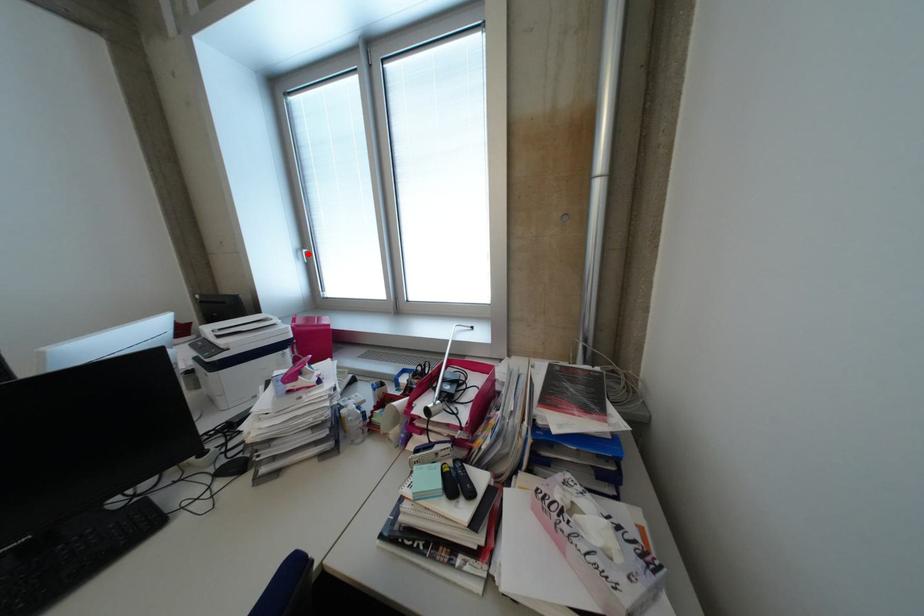
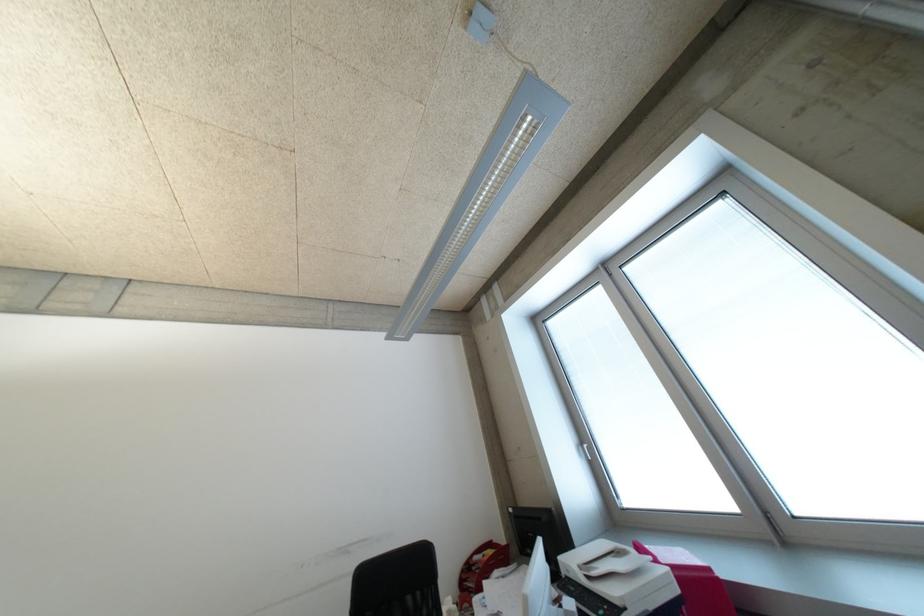
In the second image, find the point that corresponds to the highlighted location in the first image.

(589, 450)